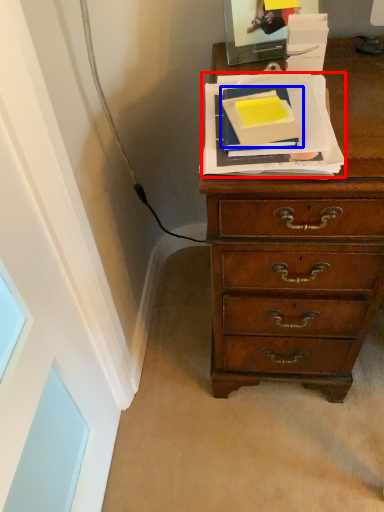
Question: Which point is closer to the camera, paperback book (highlighted by a red box) or paperback book (highlighted by a blue box)?

Choices:
 (A) paperback book
 (B) paperback book

Answer: (A)